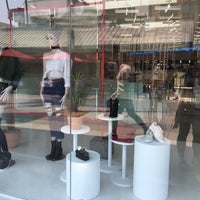
What are the coordinates of `stand` in the screenshot? It's located at (156, 172).